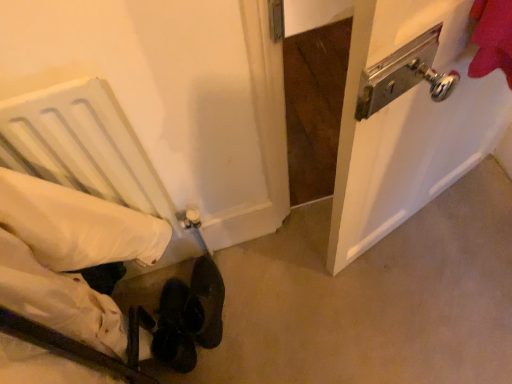
The width and height of the screenshot is (512, 384). What do you see at coordinates (83, 142) in the screenshot? I see `white fabric bed at lower left` at bounding box center [83, 142].

At what (x,y) coordinates should I click in order to perform the action: click on white fabric bed at lower left. Please return your answer as a coordinate pair (x, y). The height and width of the screenshot is (384, 512). Looking at the image, I should click on (83, 142).

Is white fabric bed at lower left in front of or behind metallic silver door handle at upper right in the image?

white fabric bed at lower left is positioned closer to the viewer than metallic silver door handle at upper right.

In terms of height, does white fabric bed at lower left look taller or shorter compared to metallic silver door handle at upper right?

Clearly, white fabric bed at lower left is taller compared to metallic silver door handle at upper right.

Is white fabric bed at lower left to the left or to the right of metallic silver door handle at upper right in the image?

white fabric bed at lower left is positioned on metallic silver door handle at upper right's left side.

Which of these two, white fabric bed at lower left or metallic silver door handle at upper right, is smaller?

With smaller size is white fabric bed at lower left.

Does metallic silver door handle at upper right turn towards white fabric bed at lower left?

No, metallic silver door handle at upper right is not aimed at white fabric bed at lower left.

From the picture: Is metallic silver door handle at upper right situated inside white fabric bed at lower left or outside?

metallic silver door handle at upper right lies outside white fabric bed at lower left.

Is metallic silver door handle at upper right bigger than white fabric bed at lower left?

Yes.

Which object is positioned more to the left, metallic silver door handle at upper right or white fabric bed at lower left?

white fabric bed at lower left is more to the left.

Is leather at lower center in front of white fabric bed at lower left?

That is False.

Considering the relative sizes of leather at lower center and white fabric bed at lower left in the image provided, is leather at lower center wider than white fabric bed at lower left?

Yes, leather at lower center is wider than white fabric bed at lower left.

Is leather at lower center taller or shorter than white fabric bed at lower left?

Clearly, leather at lower center is shorter compared to white fabric bed at lower left.

From the picture: Is leather at lower center oriented towards white fabric bed at lower left?

No.

Is metallic silver door handle at upper right turned away from leather at lower center?

No.

Between metallic silver door handle at upper right and leather at lower center, which one appears on the right side from the viewer's perspective?

Positioned to the right is metallic silver door handle at upper right.

From a real-world perspective, between metallic silver door handle at upper right and leather at lower center, who is vertically lower?

In real-world perspective, leather at lower center is lower.

Where is `footwear lying behind the white fabric bed at lower left`? This screenshot has width=512, height=384. footwear lying behind the white fabric bed at lower left is located at coordinates (205, 303).

Between white fabric bed at lower left and leather at lower center, which one has smaller size?

leather at lower center.

Which object is positioned more to the left, white fabric bed at lower left or leather at lower center?

Positioned to the left is white fabric bed at lower left.

Is white fabric bed at lower left spatially inside leather at lower center, or outside of it?

white fabric bed at lower left lies outside leather at lower center.

Which object is positioned more to the right, leather at lower center or metallic silver door handle at upper right?

metallic silver door handle at upper right.

Is leather at lower center spatially inside metallic silver door handle at upper right, or outside of it?

leather at lower center cannot be found inside metallic silver door handle at upper right.

Are leather at lower center and metallic silver door handle at upper right located far from each other?

They are positioned close to each other.

This screenshot has width=512, height=384. I want to click on door on the right of the white fabric bed at lower left, so click(408, 123).

I want to click on door behind the white fabric bed at lower left, so click(x=408, y=123).

Looking at the image, which one is located closer to white fabric bed at lower left, leather at lower center or metallic silver door handle at upper right?

leather at lower center lies closer to white fabric bed at lower left than the other object.

From the image, which object appears to be nearer to white fabric bed at lower left, metallic silver door handle at upper right or leather at lower center?

The object closer to white fabric bed at lower left is leather at lower center.

When comparing their distances from metallic silver door handle at upper right, does leather at lower center or white fabric bed at lower left seem closer?

white fabric bed at lower left is closer to metallic silver door handle at upper right.

When comparing their distances from metallic silver door handle at upper right, does white fabric bed at lower left or leather at lower center seem further?

leather at lower center is further to metallic silver door handle at upper right.

Estimate the real-world distances between objects in this image. Which object is closer to leather at lower center, metallic silver door handle at upper right or white fabric bed at lower left?

white fabric bed at lower left is positioned closer to the anchor leather at lower center.

When comparing their distances from leather at lower center, does white fabric bed at lower left or metallic silver door handle at upper right seem further?

metallic silver door handle at upper right.

Image resolution: width=512 pixels, height=384 pixels. Find the location of `footwear between white fabric bed at lower left and metallic silver door handle at upper right`. footwear between white fabric bed at lower left and metallic silver door handle at upper right is located at coordinates (205, 303).